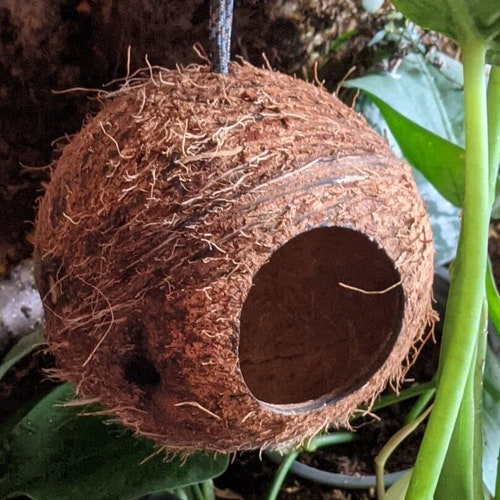
Where is `plant`? plant is located at coordinates (468, 256), (460, 460).